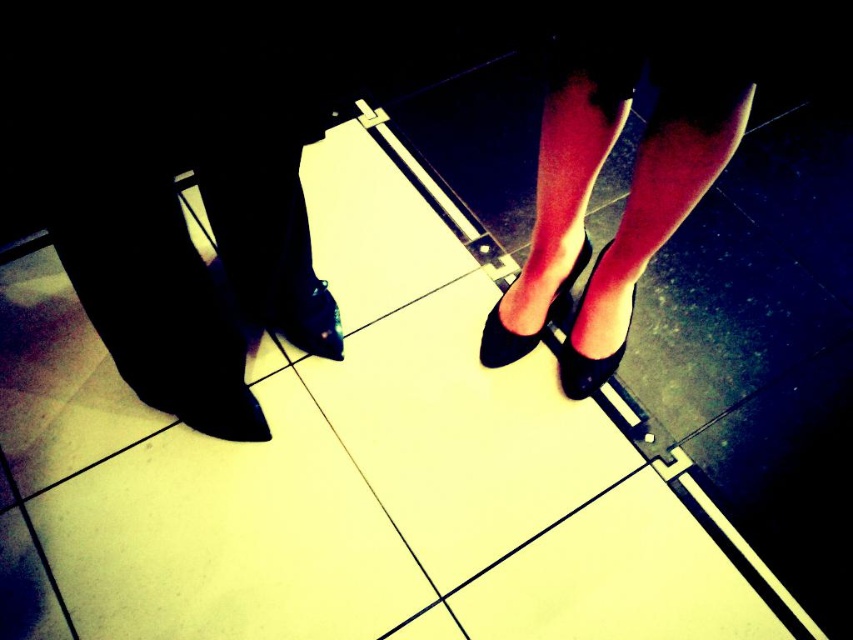
Between point (595, 358) and point (506, 364), which one is positioned behind?

Positioned behind is point (506, 364).

The height and width of the screenshot is (640, 853). What do you see at coordinates (584, 355) in the screenshot? I see `shiny black high-heeled shoe at center` at bounding box center [584, 355].

Identify the location of shiny black high-heeled shoe at center. (584, 355).

Find the location of `matte black heels at upper center`. matte black heels at upper center is located at coordinates (631, 177).

Looking at this image, can you confirm if matte black heels at upper center is positioned below shiny black high-heeled shoe at center?

Actually, matte black heels at upper center is above shiny black high-heeled shoe at center.

Does point (635, 54) come closer to viewer compared to point (608, 368)?

Yes, it is.

This screenshot has width=853, height=640. I want to click on matte black heels at upper center, so click(x=631, y=177).

Does shiny black shoe at center appear under matte black shoe at center?

Correct, shiny black shoe at center is located below matte black shoe at center.

Does point (329, 292) come in front of point (567, 276)?

Yes, it is in front of point (567, 276).

Locate an element on the screen. shiny black shoe at center is located at coordinates (308, 320).